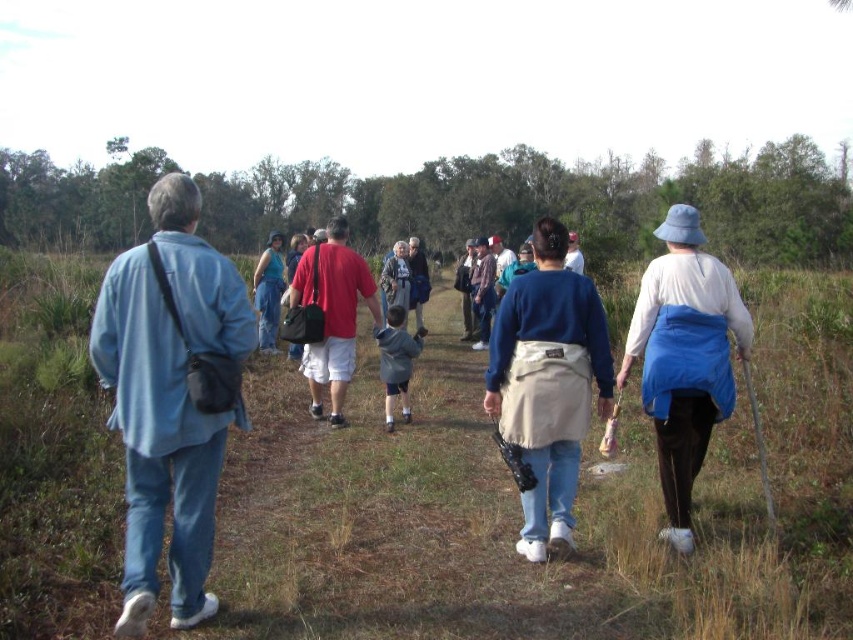
Question: Is blue fabric jacket at center bigger than white cotton shirt at center-right?

Choices:
 (A) yes
 (B) no

Answer: (B)

Question: Which point is farther to the camera?

Choices:
 (A) (657, 326)
 (B) (202, 310)
 (C) (381, 339)
 (D) (331, 221)

Answer: (D)

Question: Which object is positioned farthest from the matte red shirt at center?

Choices:
 (A) white cotton shirt at center-right
 (B) blue fabric jacket at center

Answer: (A)

Question: Can you confirm if blue denim pants at left is positioned to the left of blue fabric jacket at center?

Choices:
 (A) yes
 (B) no

Answer: (A)

Question: Is blue denim pants at left thinner than light blue denim jacket at center?

Choices:
 (A) no
 (B) yes

Answer: (B)

Question: Which point is farther to the camera?

Choices:
 (A) light blue denim jacket at center
 (B) blue denim pants at left

Answer: (A)